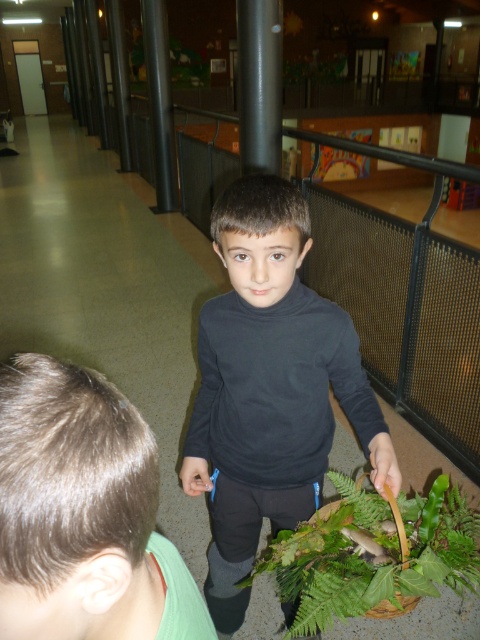
Question: Where is smooth black shirt at center located in relation to satin black pole at upper center in the image?

Choices:
 (A) left
 (B) right

Answer: (A)

Question: Is black matte shirt at center thinner than green leafy plant at lower center?

Choices:
 (A) yes
 (B) no

Answer: (B)

Question: From the image, what is the correct spatial relationship of smooth black shirt at center in relation to black metal pole at upper center?

Choices:
 (A) left
 (B) right

Answer: (B)

Question: Which point is closer to the camera?

Choices:
 (A) green leafy plant at lower center
 (B) satin black pole at upper center
 (C) black matte shirt at center
 (D) smooth black shirt at center

Answer: (D)

Question: Considering the real-world distances, which object is closest to the black matte shirt at center?

Choices:
 (A) smooth black shirt at center
 (B) black metal pole at upper center
 (C) satin black pole at upper center

Answer: (A)

Question: Which object appears closest to the camera in this image?

Choices:
 (A) satin black pole at upper center
 (B) black metal pole at upper center
 (C) green leafy plant at lower center

Answer: (C)